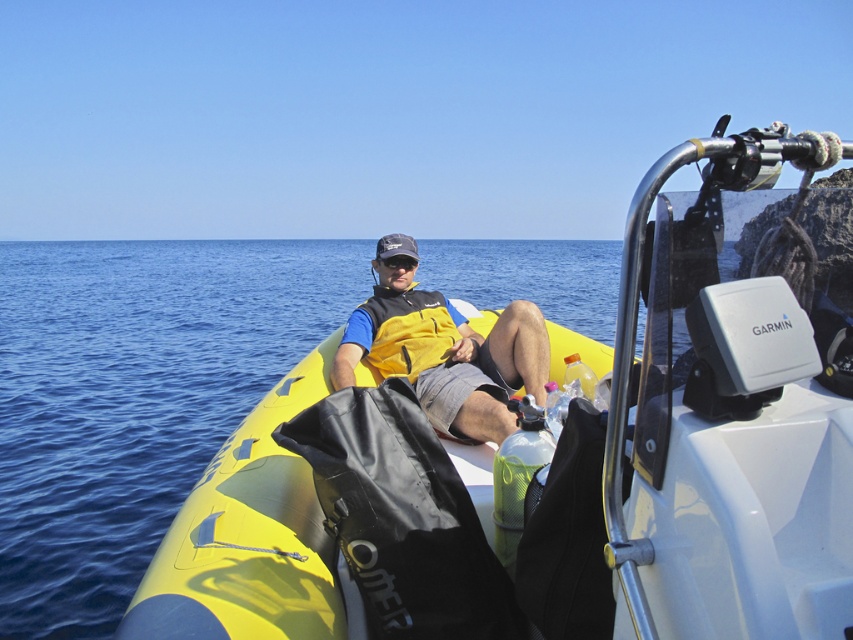
Question: Is yellow rubber boat at center below yellow fleece life jacket at center?

Choices:
 (A) no
 (B) yes

Answer: (B)

Question: Is yellow fleece life jacket at center smaller than black matte goggles at center?

Choices:
 (A) yes
 (B) no

Answer: (B)

Question: Among these objects, which one is farthest from the camera?

Choices:
 (A) yellow fleece life jacket at center
 (B) black matte goggles at center
 (C) yellow rubber boat at center

Answer: (B)

Question: Which of the following is the closest to the observer?

Choices:
 (A) black matte goggles at center
 (B) yellow matte life vest at center
 (C) yellow fleece life jacket at center
 (D) yellow rubber boat at center

Answer: (D)

Question: Among these objects, which one is farthest from the camera?

Choices:
 (A) yellow rubber boat at center
 (B) yellow matte life vest at center
 (C) yellow fleece life jacket at center
 (D) black matte goggles at center

Answer: (D)

Question: Can you confirm if yellow rubber boat at center is positioned below yellow matte life vest at center?

Choices:
 (A) no
 (B) yes

Answer: (B)